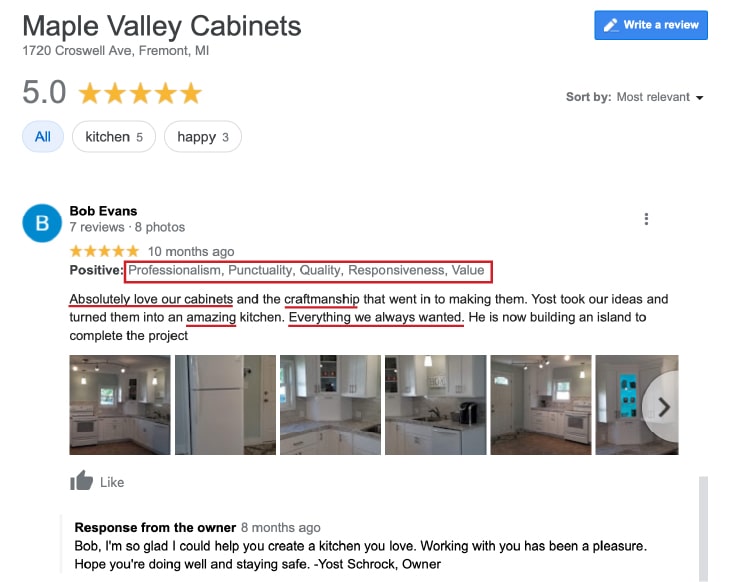
Where is `oven`? Image resolution: width=730 pixels, height=582 pixels. oven is located at coordinates (575, 422), (80, 429).